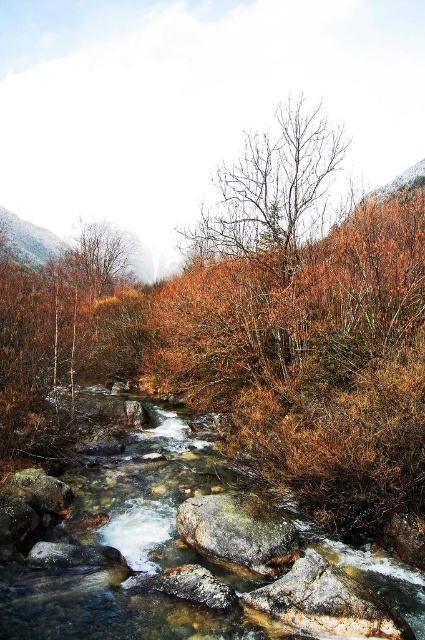
Can you confirm if rusty metallic rock at center is wider than smooth gray rock at center?

Yes, rusty metallic rock at center is wider than smooth gray rock at center.

Is rusty metallic rock at center closer to the viewer compared to smooth gray rock at center?

No.

Between point (238, 525) and point (214, 586), which one is positioned in front?

Positioned in front is point (214, 586).

At what (x,y) coordinates should I click in order to perform the action: click on rusty metallic rock at center. Please return your answer as a coordinate pair (x, y). The height and width of the screenshot is (640, 425). Looking at the image, I should click on (238, 531).

Which is more to the right, clear water at center or rusty metallic rock at center?

rusty metallic rock at center is more to the right.

Is clear water at center bigger than rusty metallic rock at center?

Yes, clear water at center is bigger than rusty metallic rock at center.

Does point (277, 616) lie in front of point (269, 547)?

Yes, point (277, 616) is in front of point (269, 547).

Locate an element on the screen. clear water at center is located at coordinates (173, 548).

Does clear water at center appear over smooth gray rock at center?

Yes, clear water at center is above smooth gray rock at center.

Does clear water at center come in front of smooth gray rock at center?

Yes.

Locate an element on the screen. This screenshot has width=425, height=640. clear water at center is located at coordinates (173, 548).